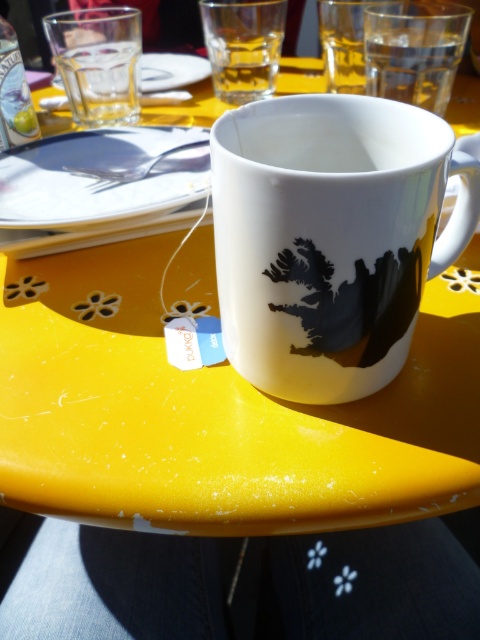
Question: Which point is farther from the camera taking this photo?

Choices:
 (A) (194, 188)
 (B) (180, 61)
 (C) (365, 147)

Answer: (B)

Question: Considering the relative positions of white porcelain saucer at upper center and transparent glass at upper left in the image provided, where is white porcelain saucer at upper center located with respect to transparent glass at upper left?

Choices:
 (A) right
 (B) left

Answer: (A)

Question: Which point is farther from the camera taking this photo?

Choices:
 (A) (140, 72)
 (B) (312, 323)

Answer: (A)

Question: Which object is closer to the camera taking this photo?

Choices:
 (A) white glossy mug at center
 (B) white porcelain saucer at upper center
 (C) transparent glass at upper left

Answer: (A)

Question: Can you confirm if white porcelain saucer at upper center is wider than transparent glass at upper left?

Choices:
 (A) yes
 (B) no

Answer: (B)

Question: Is white porcelain saucer at upper center below transparent glass at upper left?

Choices:
 (A) yes
 (B) no

Answer: (A)